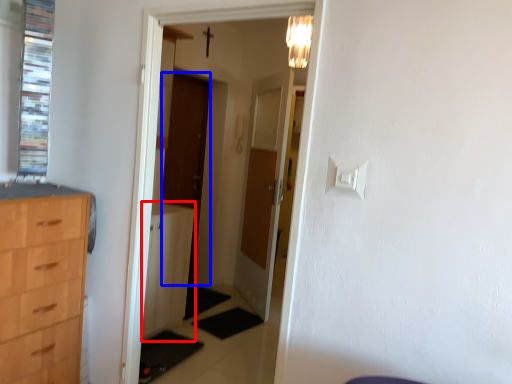
Question: Among these objects, which one is farthest to the camera, file cabinet (highlighted by a red box) or door (highlighted by a blue box)?

Choices:
 (A) file cabinet
 (B) door

Answer: (B)